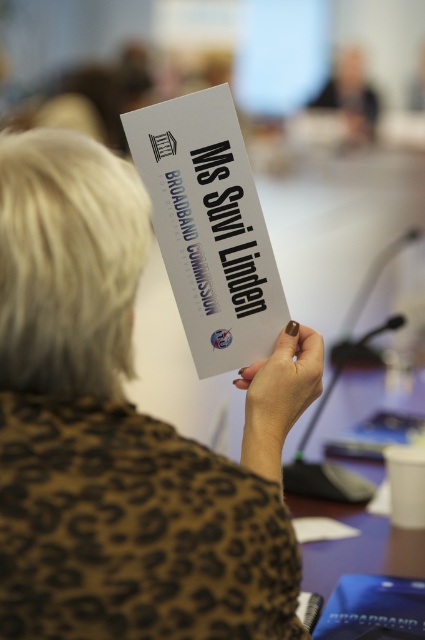
Question: Is brown leopard print shirt at center positioned in front of nail polish at center?

Choices:
 (A) yes
 (B) no

Answer: (A)

Question: Among these points, which one is farthest from the camera?

Choices:
 (A) (184, 216)
 (B) (291, 326)

Answer: (A)

Question: Which point appears farthest from the camera in this image?

Choices:
 (A) (23, 282)
 (B) (201, 161)

Answer: (B)

Question: Does white paper at center appear over purple matte table at lower right?

Choices:
 (A) no
 (B) yes

Answer: (B)

Question: Based on their relative distances, which object is farther from the brown leopard print shirt at center?

Choices:
 (A) white paper at center
 (B) nail polish at center

Answer: (A)

Question: Can you confirm if white paper at center is smaller than nail polish at center?

Choices:
 (A) no
 (B) yes

Answer: (A)